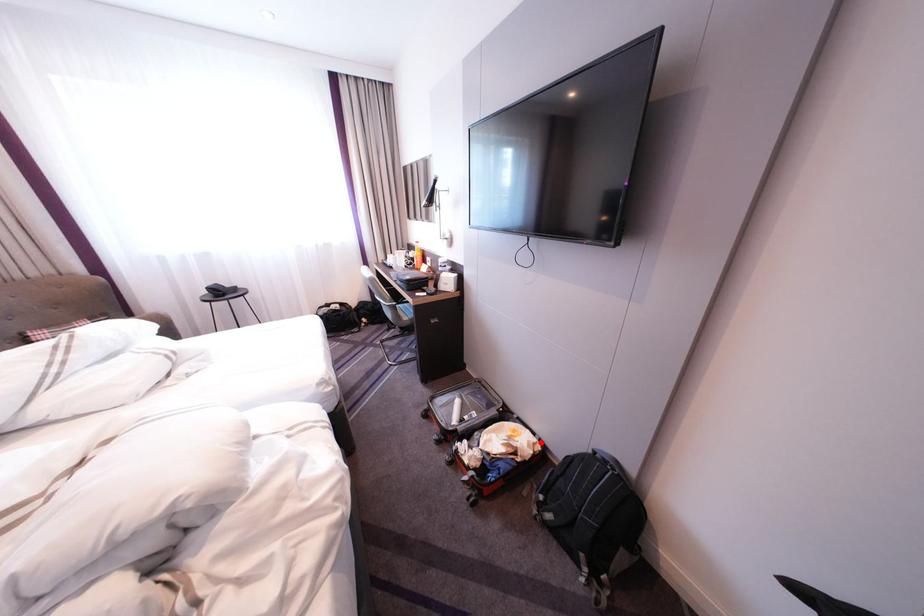
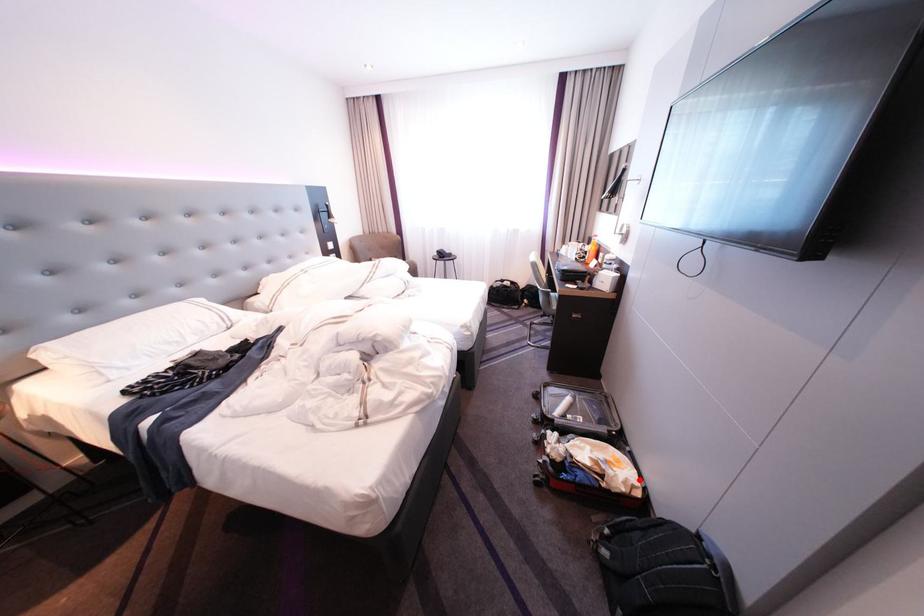
I am providing you with two images of the same scene from different viewpoints. A red point is marked on the first image and another point is marked on the second image. Is the marked point in image1 the same physical position as the marked point in image2?

Yes